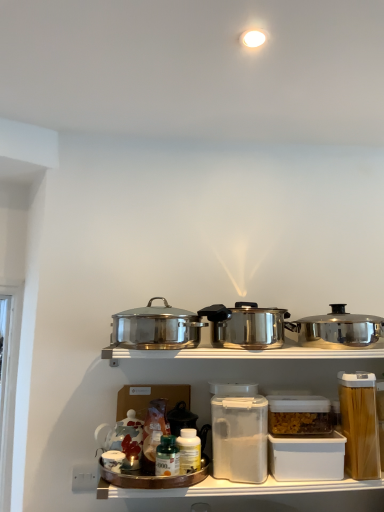
Question: Which direction should I rotate to look at polished stainless steel pot at center, the 2th kitchen appliance when ordered from left to right, — up or down?

Choices:
 (A) down
 (B) up

Answer: (A)

Question: Considering the relative sizes of translucent plastic container at center, placed as the first appliance when sorted from left to right, and clear plastic container at center, the 2th appliance when ordered from left to right, in the image provided, is translucent plastic container at center, placed as the first appliance when sorted from left to right, thinner than clear plastic container at center, the 2th appliance when ordered from left to right,?

Choices:
 (A) no
 (B) yes

Answer: (A)

Question: Is clear plastic container at center, which is counted as the 2th appliance, starting from the right, located within translucent plastic container at center, placed as the first appliance when sorted from left to right?

Choices:
 (A) yes
 (B) no

Answer: (B)

Question: Is translucent plastic container at center, placed as the first appliance when sorted from left to right, in contact with clear plastic container at center, which is counted as the 2th appliance, starting from the right?

Choices:
 (A) no
 (B) yes

Answer: (A)

Question: Can you confirm if translucent plastic container at center, which ranks as the 3th appliance in right-to-left order, is taller than clear plastic container at center, the 2th appliance when ordered from left to right?

Choices:
 (A) yes
 (B) no

Answer: (A)

Question: From a real-world perspective, is translucent plastic container at center, which ranks as the 3th appliance in right-to-left order, over clear plastic container at center, which is counted as the 2th appliance, starting from the right?

Choices:
 (A) no
 (B) yes

Answer: (A)

Question: Does translucent plastic container at center, which ranks as the 3th appliance in right-to-left order, come behind clear plastic container at center, which is counted as the 2th appliance, starting from the right?

Choices:
 (A) no
 (B) yes

Answer: (A)

Question: From a real-world perspective, is green glass bottle at center, the first bottle from the left, positioned under polished stainless steel pot at center, placed as the first kitchen appliance when sorted from left to right, based on gravity?

Choices:
 (A) yes
 (B) no

Answer: (A)

Question: Is green glass bottle at center, positioned as the second bottle in right-to-left order, oriented towards polished stainless steel pot at center, arranged as the third kitchen appliance when viewed from the right?

Choices:
 (A) no
 (B) yes

Answer: (A)

Question: Is green glass bottle at center, positioned as the second bottle in right-to-left order, closer to camera compared to polished stainless steel pot at center, arranged as the third kitchen appliance when viewed from the right?

Choices:
 (A) no
 (B) yes

Answer: (A)

Question: From the image's perspective, would you say green glass bottle at center, positioned as the second bottle in right-to-left order, is positioned over polished stainless steel pot at center, arranged as the third kitchen appliance when viewed from the right?

Choices:
 (A) no
 (B) yes

Answer: (A)

Question: Is green glass bottle at center, positioned as the second bottle in right-to-left order, positioned behind polished stainless steel pot at center, placed as the first kitchen appliance when sorted from left to right?

Choices:
 (A) yes
 (B) no

Answer: (A)

Question: Can you confirm if green glass bottle at center, positioned as the second bottle in right-to-left order, is shorter than polished stainless steel pot at center, arranged as the third kitchen appliance when viewed from the right?

Choices:
 (A) yes
 (B) no

Answer: (A)

Question: Does polished stainless steel pot at center, the 2th kitchen appliance when ordered from left to right, have a greater height compared to green glass bottle at center, the first bottle from the left?

Choices:
 (A) yes
 (B) no

Answer: (A)